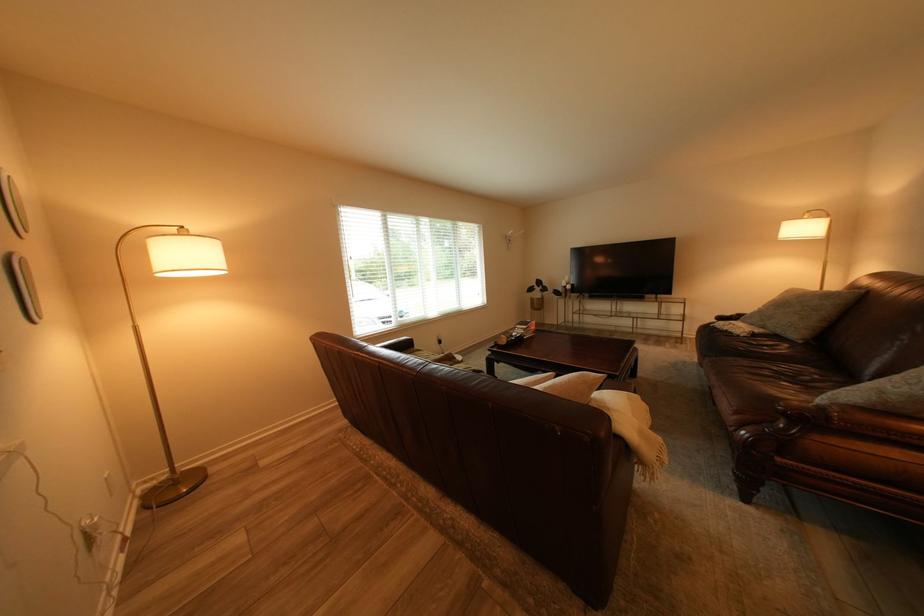
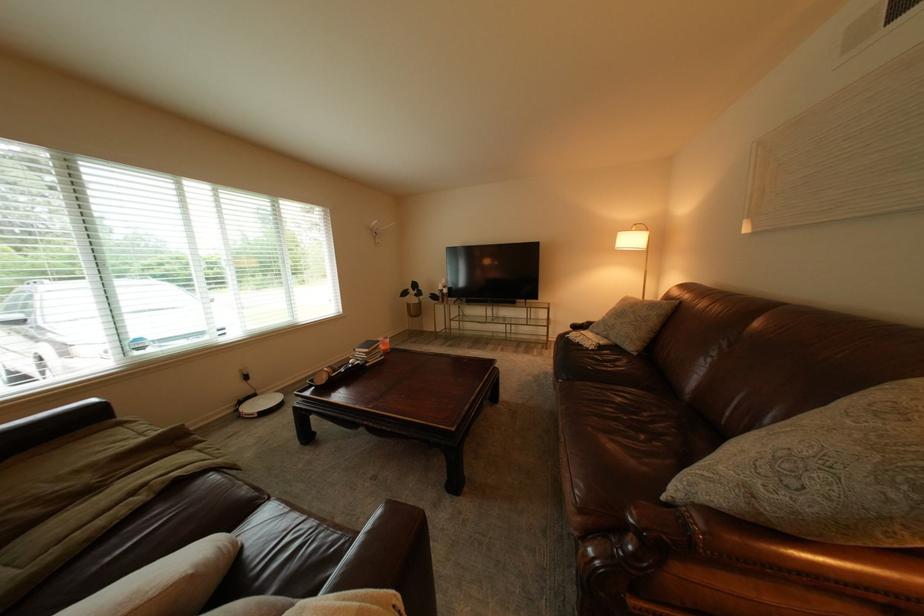
The point at (531, 334) is marked in the first image. Where is the corresponding point in the second image?

(371, 361)